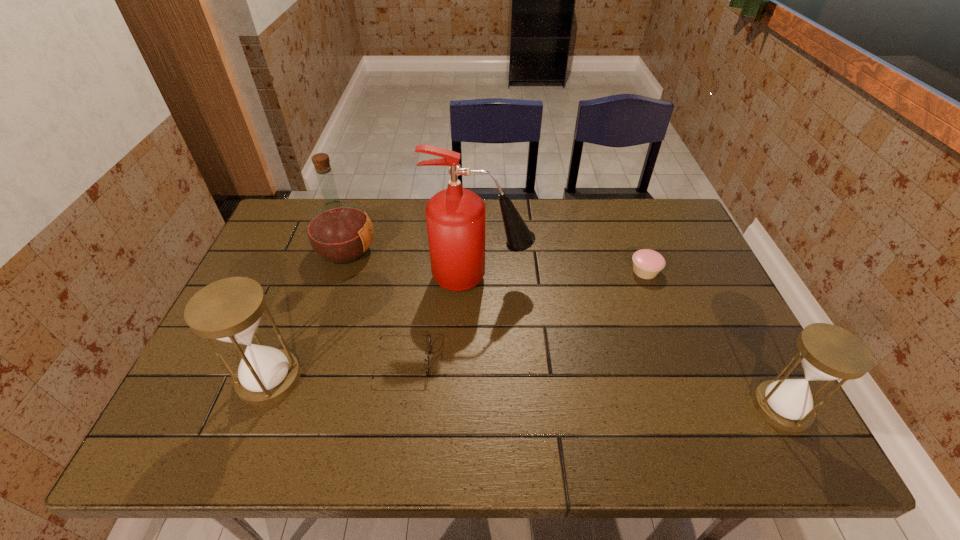
The height and width of the screenshot is (540, 960). Find the location of `vacant area in the image that satisfies the following two spatial constraints: 1. on the front label of the liquor; 2. on the back side of the rightmost object`. vacant area in the image that satisfies the following two spatial constraints: 1. on the front label of the liquor; 2. on the back side of the rightmost object is located at coordinates (296, 407).